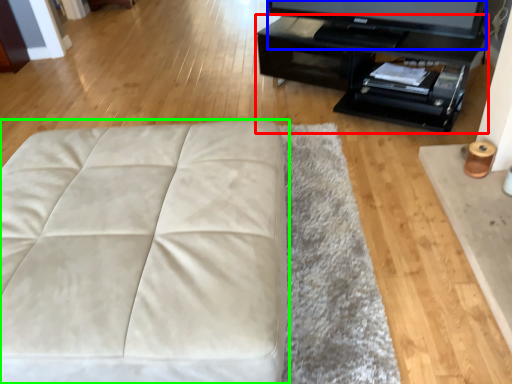
Question: Which object is positioned farthest from table (highlighted by a red box)? Select from television (highlighted by a blue box) and furniture (highlighted by a green box).

Choices:
 (A) television
 (B) furniture

Answer: (B)